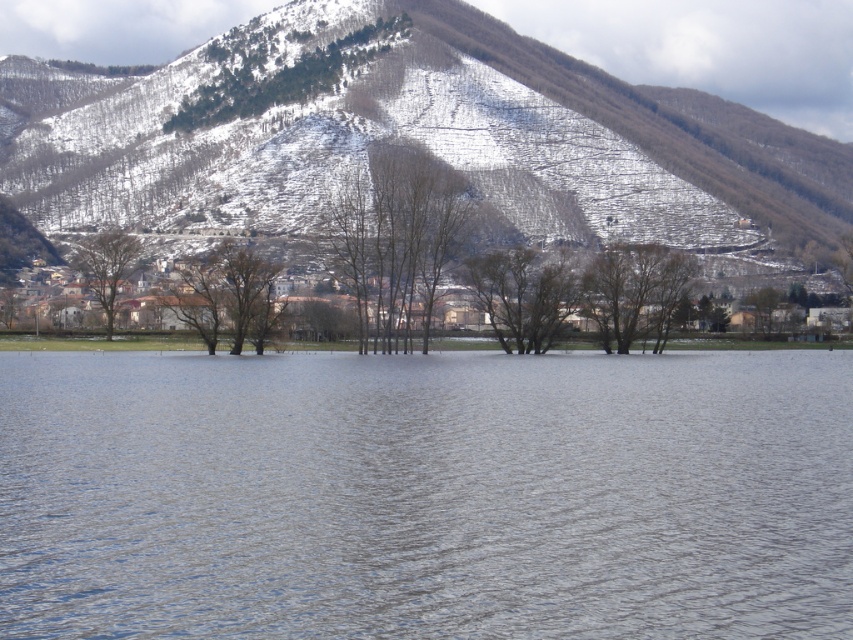
Question: Which of the following is the farthest from the observer?

Choices:
 (A) (254, 106)
 (B) (389, 220)
 (C) (103, 257)
 (D) (316, 28)

Answer: (D)

Question: Which of these objects is positioned farthest from the snowy forested mountain at center?

Choices:
 (A) bare branches at center
 (B) green textured trees at upper center
 (C) clear water at center
 (D) brown matte tree at center

Answer: (C)

Question: Which of the following is the closest to the observer?

Choices:
 (A) (302, 362)
 (B) (437, 234)

Answer: (A)

Question: Is snowy forested mountain at center to the right of bare branches at center from the viewer's perspective?

Choices:
 (A) no
 (B) yes

Answer: (A)

Question: Does snowy forested mountain at center appear over bare branches at center?

Choices:
 (A) no
 (B) yes

Answer: (B)

Question: Does clear water at center have a larger size compared to bare branches at center?

Choices:
 (A) no
 (B) yes

Answer: (A)